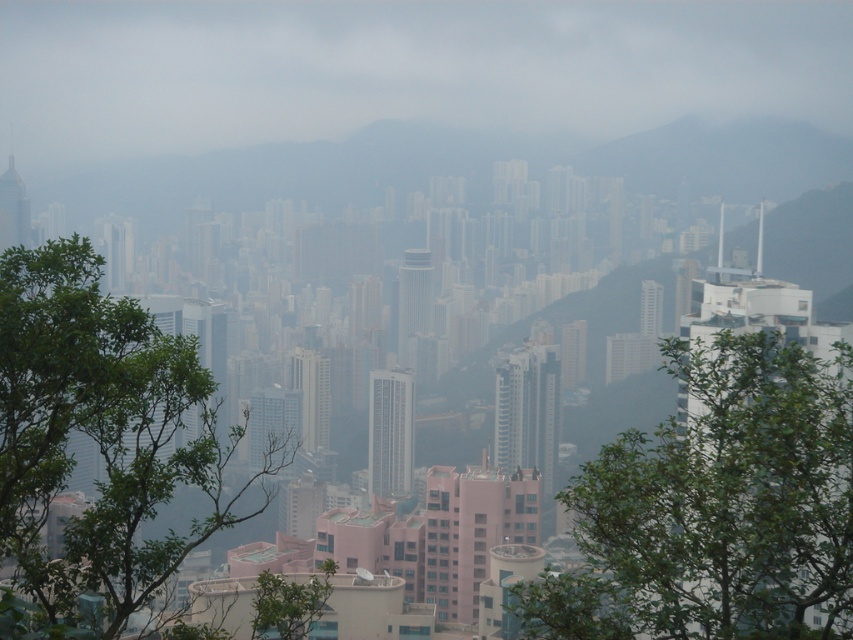
You are standing in a park overlooking the city. You see two green leafy trees in the scene. Which tree, the green leafy tree at center or the green leafy tree at left, is closer to you?

The green leafy tree at center is closer to you because it is further to the viewer than the green leafy tree at left.

You are standing at the viewpoint of the image. If you look towards the center of the scene, where would you see the green leafy tree at center?

The green leafy tree at center is located at the coordinates point [717,508].

You are standing at the viewpoint and see two points in the cityscape. Which point, point (524,616) or point (202,369), is closer to your current position?

Point (202,369) is closer to your current position because it is less further to the camera than point (524,616).